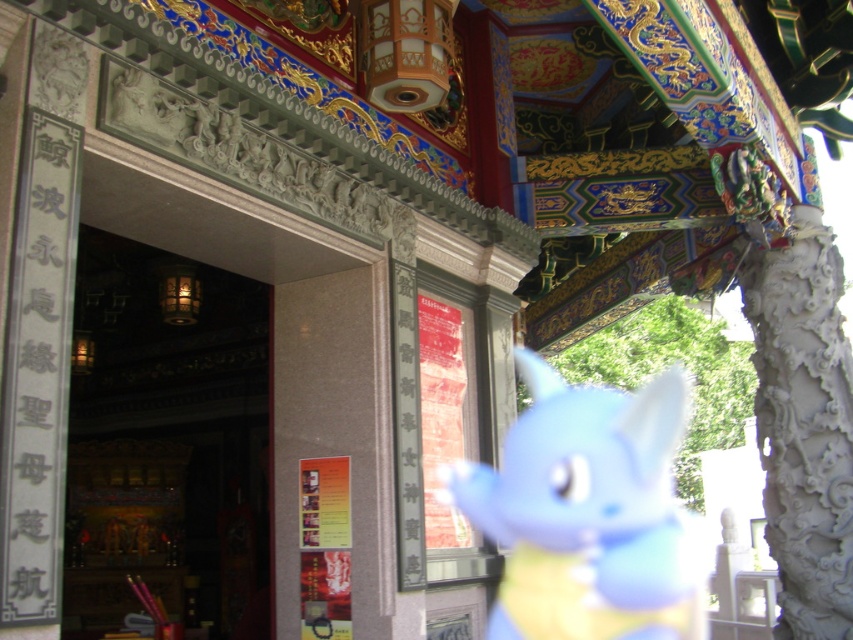
You are a visitor at this temple and want to pass through the wooden carved door at center. However, you are carrying a blue plush toy at center that is wider than the door. Can you fit through the door while holding the toy?

The wooden carved door at center has a lesser width compared to blue plush toy at center, so the door is narrower than the toy. Therefore, you cannot fit through the door while holding the blue plush toy at center as it is wider than the doorway.

You are visiting the temple and want to take a photo of both the wooden carved door at center and the blue plush toy at center. Since you have a camera with a fixed focal length, you need to adjust your distance to ensure both are in frame. Which object should you move closer to, and which should you move away from?

Since the wooden carved door at center is taller than the blue plush toy at center, you should move closer to the wooden carved door at center and move away from the blue plush toy at center to ensure both are in frame.